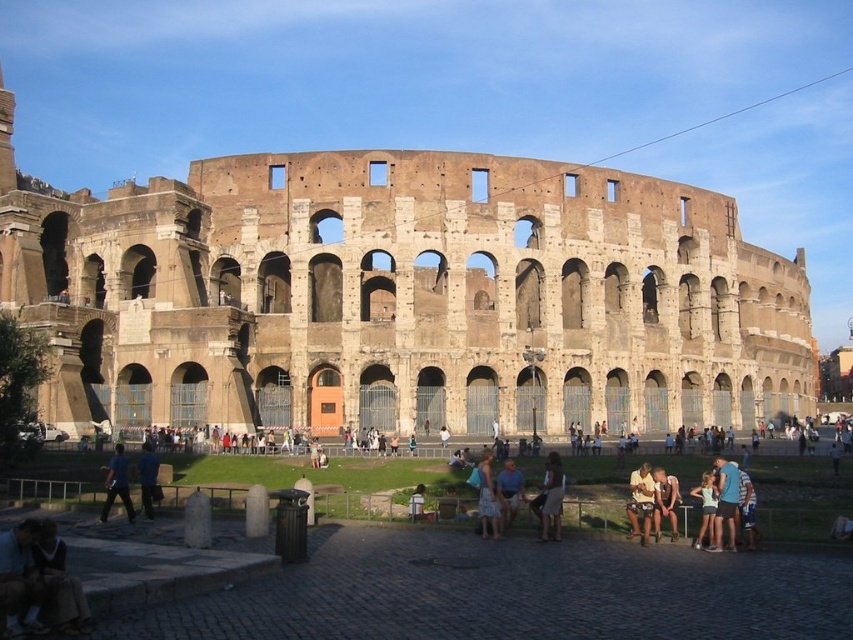
Between brown stone amphitheater at center and light blue denim shorts at lower right, which one is positioned higher?

brown stone amphitheater at center is above.

Does brown stone amphitheater at center appear under light blue denim shorts at lower right?

No, brown stone amphitheater at center is not below light blue denim shorts at lower right.

Where is `brown stone amphitheater at center`? brown stone amphitheater at center is located at coordinates (403, 296).

Where is `brown stone amphitheater at center`? brown stone amphitheater at center is located at coordinates (403, 296).

Is point (344, 301) less distant than point (549, 490)?

No, it is not.

Who is lower down, brown stone amphitheater at center or light brown fabric dress at lower right?

Positioned lower is light brown fabric dress at lower right.

Who is more forward, (135, 284) or (556, 528)?

Point (556, 528) is more forward.

Where is `brown stone amphitheater at center`? brown stone amphitheater at center is located at coordinates (403, 296).

Does patterned fabric dress at center have a larger size compared to light blue denim shorts at lower right?

No, patterned fabric dress at center is not bigger than light blue denim shorts at lower right.

Is point (482, 464) farther from camera compared to point (706, 474)?

Yes.

Identify the location of patterned fabric dress at center. The height and width of the screenshot is (640, 853). (486, 497).